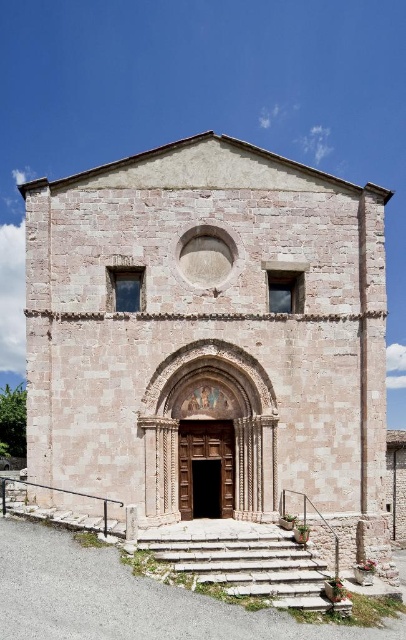
Question: Can you confirm if stone steps at lower center is thinner than brown wooden door at center?

Choices:
 (A) yes
 (B) no

Answer: (B)

Question: Can you confirm if light pink stone chapel at center is positioned above stone steps at lower center?

Choices:
 (A) yes
 (B) no

Answer: (A)

Question: Estimate the real-world distances between objects in this image. Which object is closer to the brown wooden door at center?

Choices:
 (A) light pink stone chapel at center
 (B) stone steps at lower center

Answer: (B)

Question: Where is light pink stone chapel at center located in relation to stone steps at lower center in the image?

Choices:
 (A) left
 (B) right

Answer: (B)

Question: Which of the following is the farthest from the observer?

Choices:
 (A) (308, 554)
 (B) (250, 420)

Answer: (B)

Question: Which point is closer to the camera taking this photo?

Choices:
 (A) (161, 168)
 (B) (222, 538)
 (C) (200, 428)

Answer: (B)